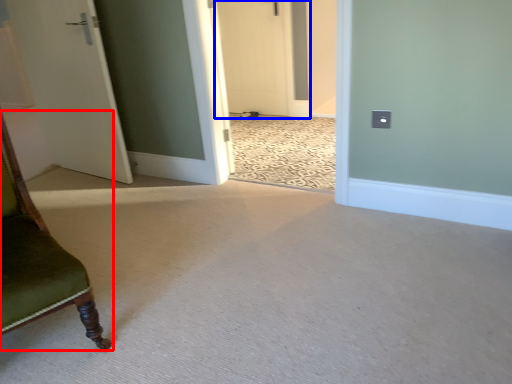
Question: Among these objects, which one is nearest to the camera, furniture (highlighted by a red box) or door (highlighted by a blue box)?

Choices:
 (A) furniture
 (B) door

Answer: (A)